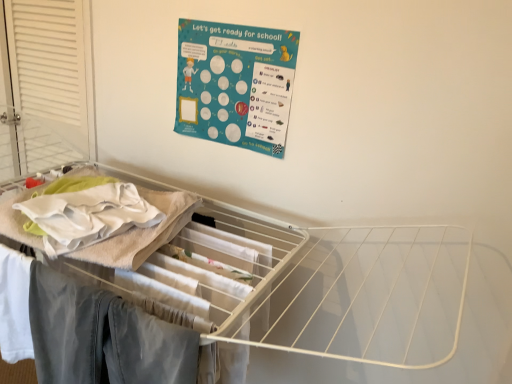
Question: Is denim pants at lower left beside teal paperboard poster at upper center?

Choices:
 (A) yes
 (B) no

Answer: (B)

Question: Considering the relative sizes of denim pants at lower left and teal paperboard poster at upper center in the image provided, is denim pants at lower left taller than teal paperboard poster at upper center?

Choices:
 (A) yes
 (B) no

Answer: (A)

Question: Can you confirm if denim pants at lower left is shorter than teal paperboard poster at upper center?

Choices:
 (A) yes
 (B) no

Answer: (B)

Question: Can you confirm if denim pants at lower left is wider than teal paperboard poster at upper center?

Choices:
 (A) no
 (B) yes

Answer: (B)

Question: Considering the relative positions of denim pants at lower left and teal paperboard poster at upper center in the image provided, is denim pants at lower left behind teal paperboard poster at upper center?

Choices:
 (A) no
 (B) yes

Answer: (A)

Question: Considering the relative positions of denim pants at lower left and teal paperboard poster at upper center in the image provided, is denim pants at lower left to the left of teal paperboard poster at upper center from the viewer's perspective?

Choices:
 (A) yes
 (B) no

Answer: (A)

Question: Does white louvered screen door at left contain white wire drying rack at upper center?

Choices:
 (A) no
 (B) yes

Answer: (A)

Question: Considering the relative sizes of white louvered screen door at left and white wire drying rack at upper center in the image provided, is white louvered screen door at left smaller than white wire drying rack at upper center?

Choices:
 (A) no
 (B) yes

Answer: (B)

Question: Is white louvered screen door at left shorter than white wire drying rack at upper center?

Choices:
 (A) no
 (B) yes

Answer: (B)

Question: Is white louvered screen door at left taller than white wire drying rack at upper center?

Choices:
 (A) no
 (B) yes

Answer: (A)

Question: Is white louvered screen door at left at the left side of white wire drying rack at upper center?

Choices:
 (A) no
 (B) yes

Answer: (B)

Question: Considering the relative sizes of white louvered screen door at left and white wire drying rack at upper center in the image provided, is white louvered screen door at left wider than white wire drying rack at upper center?

Choices:
 (A) yes
 (B) no

Answer: (B)

Question: From the image's perspective, is white wire drying rack at upper center below white louvered screen door at left?

Choices:
 (A) no
 (B) yes

Answer: (B)